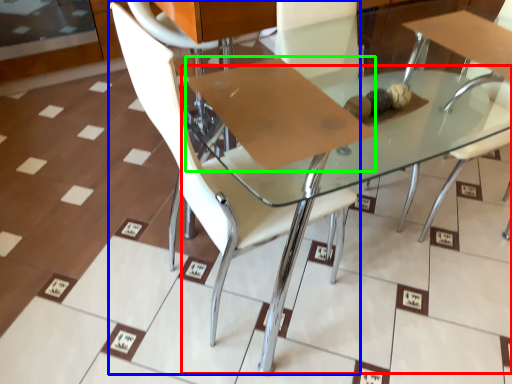
Question: Which object is positioned closest to round table (highlighted by a red box)? Select from chair (highlighted by a blue box) and cardboard (highlighted by a green box).

Choices:
 (A) chair
 (B) cardboard

Answer: (B)